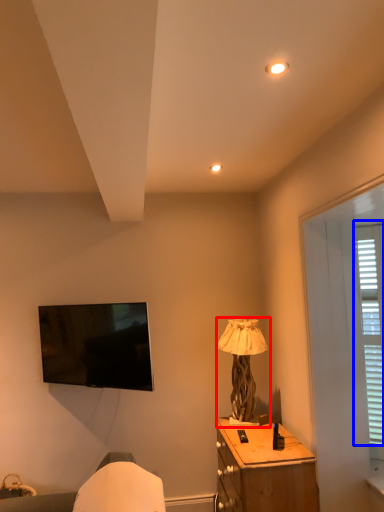
Question: Which object appears farthest to the camera in this image, lamp (highlighted by a red box) or bay window (highlighted by a blue box)?

Choices:
 (A) lamp
 (B) bay window

Answer: (A)